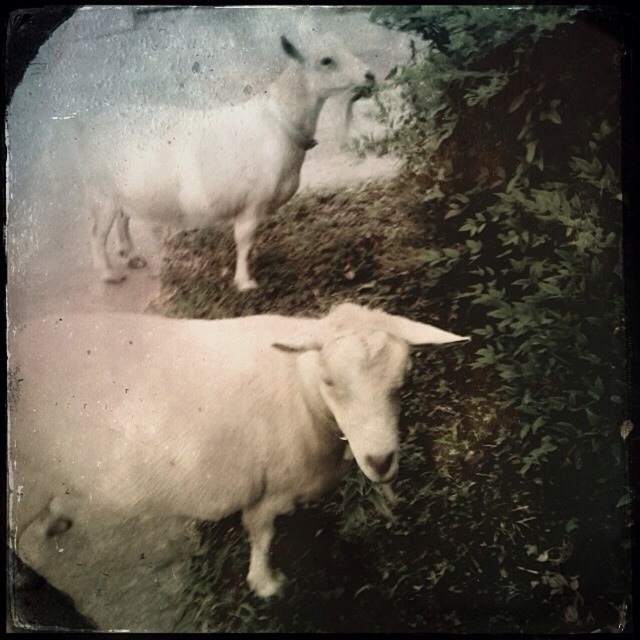
You are a photographer trying to capture a detailed shot of the green leafy grass at upper center located at point (x=468, y=342). However, there is a goat facing the camera in the foreground. Will the goat block your view of the green leafy grass at upper center?

The green leafy grass at upper center is located at point (x=468, y=342), which is in the upper center of the image. The foreground goat is blocking the view of the green leafy grass at upper center because it is in front of it.

You are a photographer trying to capture a photo of the white woolen sheep at lower left and the green leafy grass at upper center. According to the scene, which object is positioned to the right of the other?

The green leafy grass at upper center is to the right of the white woolen sheep at lower left.